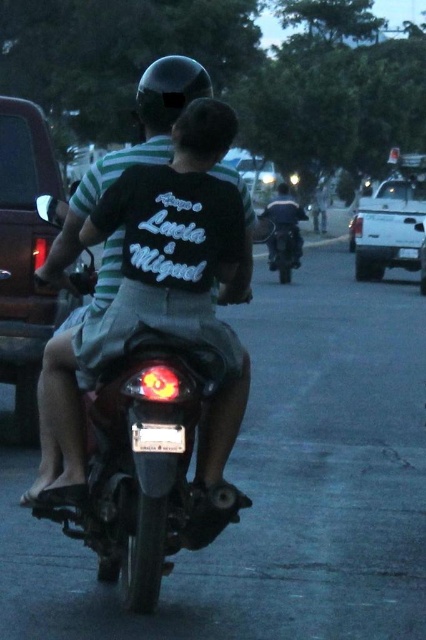
Can you confirm if white matte pickup truck at upper right is shorter than shiny black motorcycle at center?

Incorrect, white matte pickup truck at upper right's height does not fall short of shiny black motorcycle at center's.

In the scene shown: Which is below, white matte pickup truck at upper right or shiny black motorcycle at center?

shiny black motorcycle at center is below.

This screenshot has width=426, height=640. What are the coordinates of `white matte pickup truck at upper right` in the screenshot? It's located at point(388,227).

Is matte black motorcycle at center smaller than shiny black motorcycle at center?

Yes.

Describe the element at coordinates (143, 292) in the screenshot. I see `matte black motorcycle at center` at that location.

This screenshot has height=640, width=426. I want to click on matte black motorcycle at center, so click(x=143, y=292).

Can you confirm if matte black motorcycle at center is positioned to the right of white matte pickup truck at upper right?

Incorrect, matte black motorcycle at center is not on the right side of white matte pickup truck at upper right.

What do you see at coordinates (143, 292) in the screenshot? The width and height of the screenshot is (426, 640). I see `matte black motorcycle at center` at bounding box center [143, 292].

Between point (48, 428) and point (367, 268), which one is positioned in front?

Point (48, 428) is in front.

Identify the location of matte black motorcycle at center. The image size is (426, 640). (143, 292).